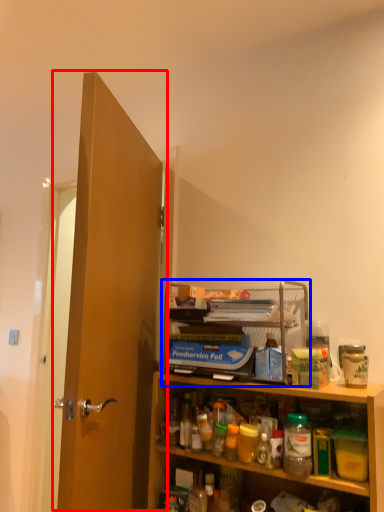
Question: Which object appears closest to the camera in this image, door (highlighted by a red box) or shelf (highlighted by a blue box)?

Choices:
 (A) door
 (B) shelf

Answer: (A)